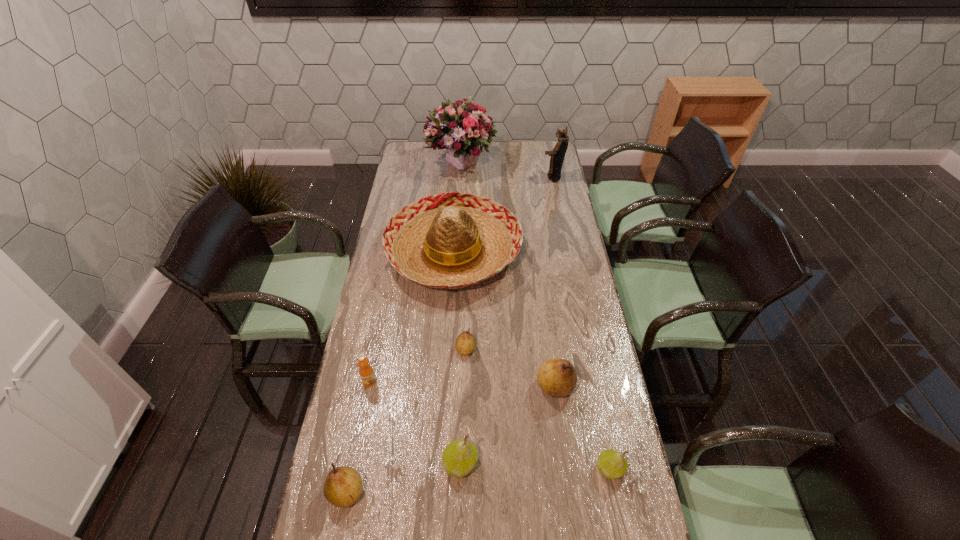
Where is `unoccupied area between the right green pear and the red sombrero`? This screenshot has width=960, height=540. unoccupied area between the right green pear and the red sombrero is located at coordinates (532, 361).

The image size is (960, 540). I want to click on free space between the leftmost brown pear and the figurine, so click(449, 335).

Find the location of a particular element. Image resolution: width=960 pixels, height=540 pixels. vacant space that's between the shortest object and the rightmost pear is located at coordinates (538, 409).

Select which object appears as the closest to the fourth pear from left to right. Please provide its 2D coordinates. Your answer should be formatted as a tuple, i.e. [(x, y)], where the tuple contains the x and y coordinates of a point satisfying the conditions above.

[(611, 463)]

At what (x,y) coordinates should I click in order to perform the action: click on object that is the third closest one to the second tallest object. Please return your answer as a coordinate pair (x, y). The width and height of the screenshot is (960, 540). Looking at the image, I should click on (465, 344).

Locate an element on the screen. The image size is (960, 540). pear identified as the second closest to the sombrero is located at coordinates (557, 377).

Point out which pear is positioned as the third nearest to the seventh shortest object. Please provide its 2D coordinates. Your answer should be formatted as a tuple, i.e. [(x, y)], where the tuple contains the x and y coordinates of a point satisfying the conditions above.

[(459, 458)]

Image resolution: width=960 pixels, height=540 pixels. I want to click on brown pear that stands as the closest to the nearest brown pear, so click(x=465, y=344).

This screenshot has height=540, width=960. Find the location of `brown pear that is the second nearest to the sombrero`. brown pear that is the second nearest to the sombrero is located at coordinates (557, 377).

Locate an element on the screen. The height and width of the screenshot is (540, 960). the second closest green pear to the eighth shortest object is located at coordinates (459, 458).